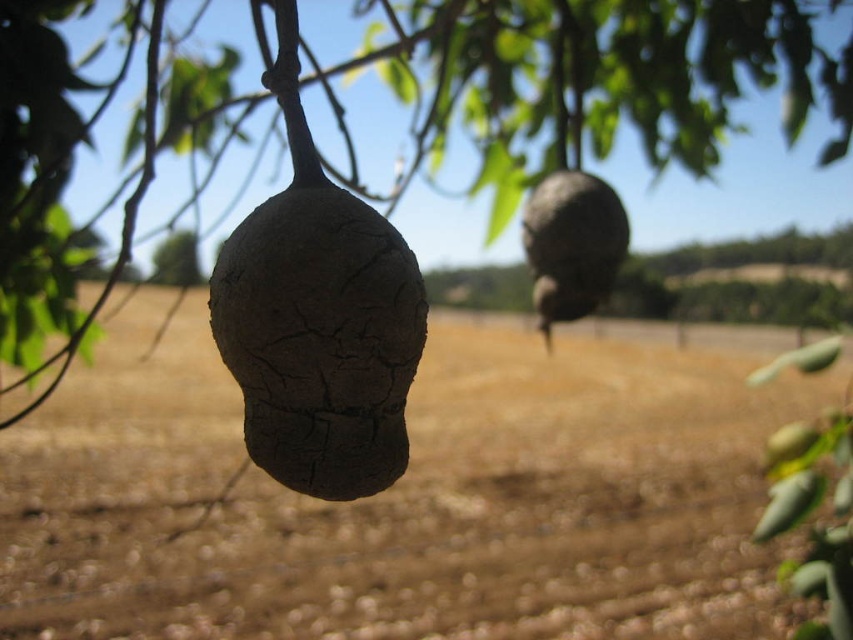
Question: Can you confirm if brown soil at center is positioned above rough bark fruit at center?

Choices:
 (A) yes
 (B) no

Answer: (B)

Question: Which object is the closest to the leathery brown pod at center?

Choices:
 (A) cracked brown pod at center
 (B) rough bark fruit at center

Answer: (A)

Question: Which object appears farthest from the camera in this image?

Choices:
 (A) cracked brown pod at center
 (B) brown soil at center
 (C) rough bark fruit at center

Answer: (C)

Question: Which point is closer to the camera?

Choices:
 (A) (258, 524)
 (B) (804, 35)

Answer: (B)

Question: Can you confirm if brown soil at center is thinner than leathery brown pod at center?

Choices:
 (A) yes
 (B) no

Answer: (B)

Question: Can you confirm if cracked brown fruit at center is wider than rough bark fruit at center?

Choices:
 (A) yes
 (B) no

Answer: (B)